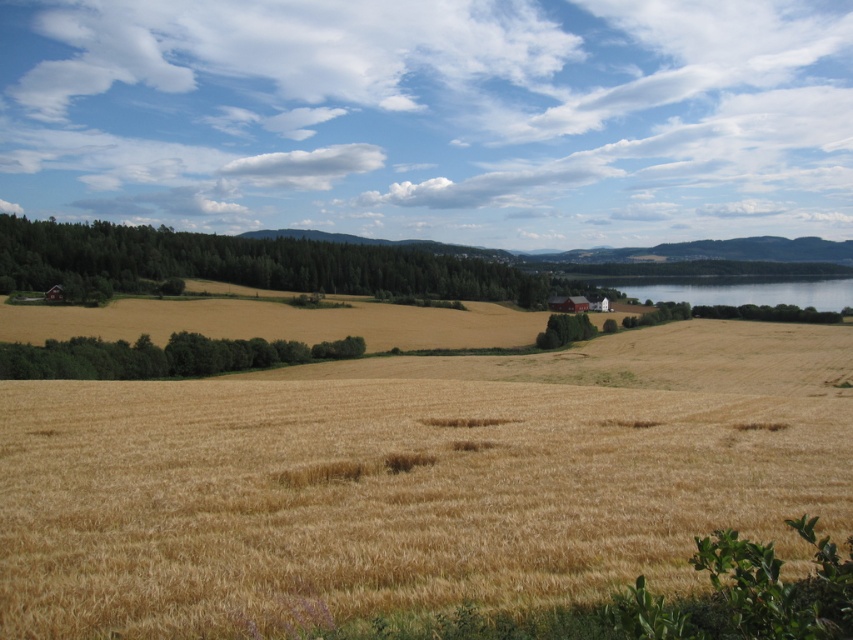
You are standing in the middle of the wheat field and see the green leafy trees at left and the green leafy trees at center. Which group of trees is farther away from you?

The green leafy trees at center are farther away because they are positioned behind the green leafy trees at left.

You are standing in the rural landscape and want to take a photo of the golden wheat field at center and the green leafy trees at left. Which object should you focus on first if you want both to be in sharp focus?

The golden wheat field at center is closer to the viewer than the green leafy trees at left, so you should focus on the golden wheat field at center first to ensure both are in sharp focus.

Based on the photo, you are a farmer who wants to cross from the golden wheat field at center to the transparent blue water at right. Which direction should you head to reach the water?

The golden wheat field at center is to the left of transparent blue water at right, so you should head to the right to reach the water.